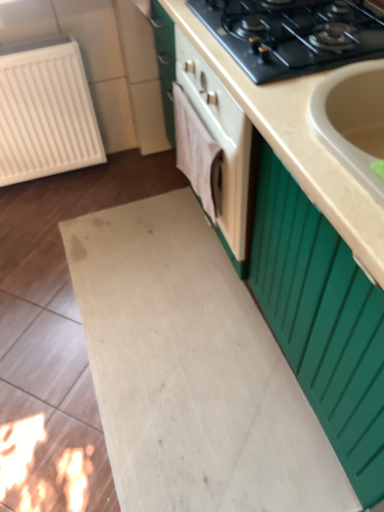
Question: Relative to black matte gas stove at upper center, is beige matte countertop at center in front or behind?

Choices:
 (A) front
 (B) behind

Answer: (A)

Question: In the image, is beige matte countertop at center on the left side or the right side of black matte gas stove at upper center?

Choices:
 (A) left
 (B) right

Answer: (B)

Question: Which object is positioned farthest from the beige matte countertop at center?

Choices:
 (A) white plastic radiator at left
 (B) black matte gas stove at upper center

Answer: (A)

Question: Considering the real-world distances, which object is farthest from the white plastic radiator at left?

Choices:
 (A) beige matte countertop at center
 (B) black matte gas stove at upper center

Answer: (B)